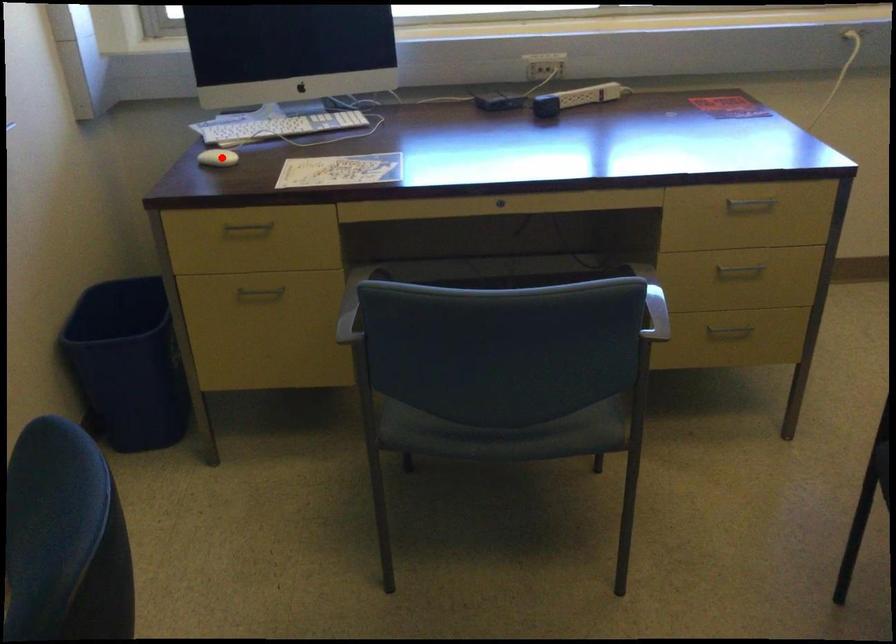
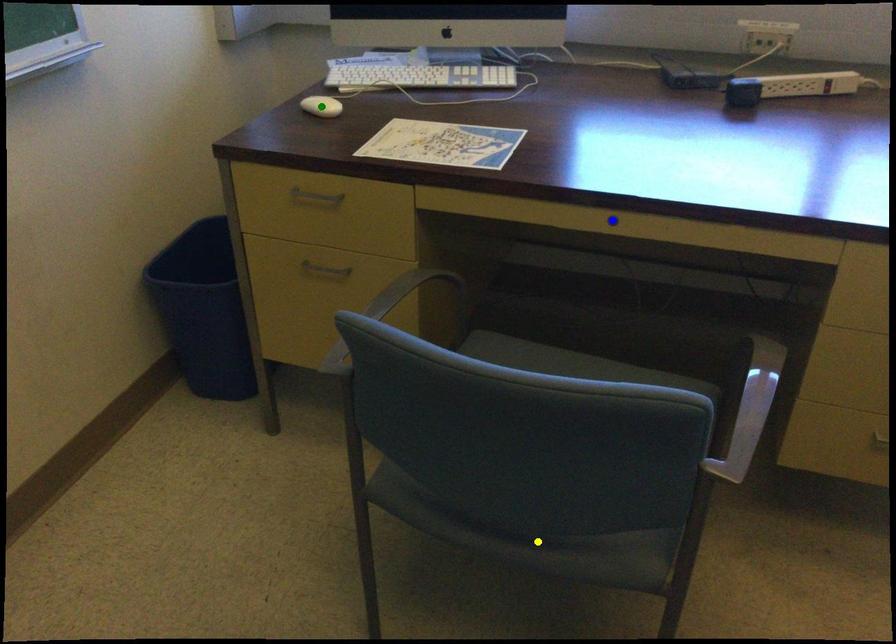
Question: I am providing you with two images of the same scene from different viewpoints. A red point is marked on the first image. You are given multiple points on the second image. Which spot in image 2 lines up with the point in image 1?

Choices:
 (A) blue point
 (B) yellow point
 (C) green point

Answer: (C)